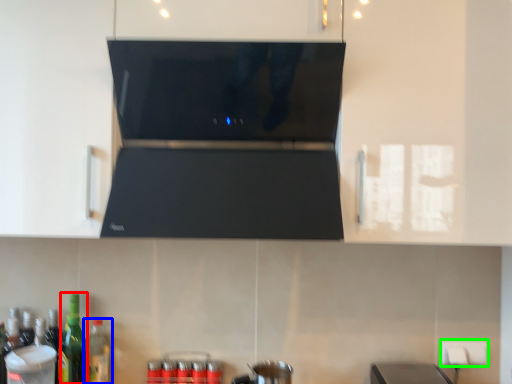
Question: Which object is positioned farthest from bottle (highlighted by a red box)? Select from bottle (highlighted by a blue box) and electric outlet (highlighted by a green box).

Choices:
 (A) bottle
 (B) electric outlet

Answer: (B)